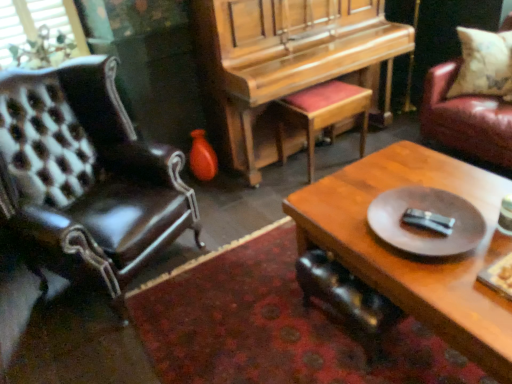
I want to click on vacant space in between wooden coffee table at center and leather chair at left, which is counted as the 1th chair, starting from the left, so click(237, 297).